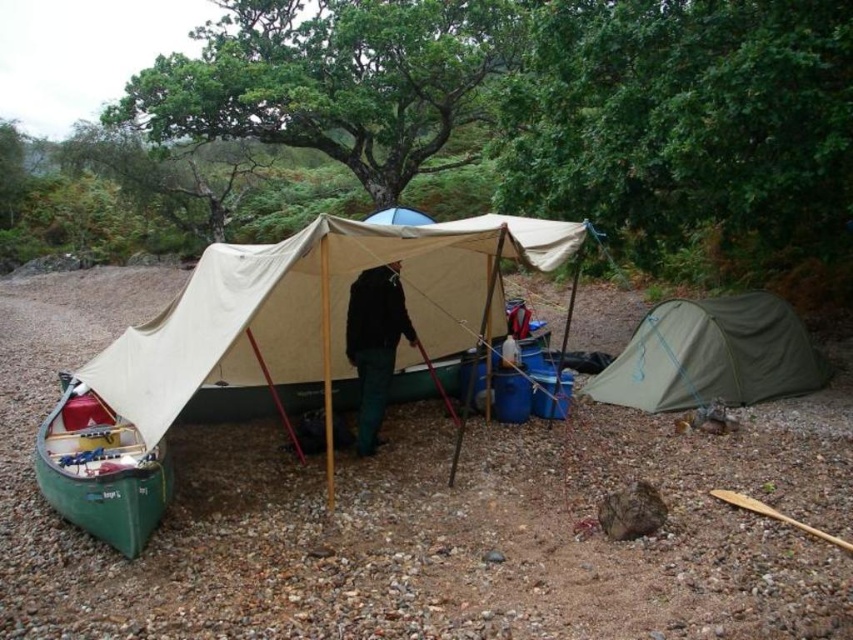
From the picture: You are setting up a campsite and need to access the items stored in the green matte canoe at lower left. However, there is a green fabric tent at lower right in the way. Based on the scene, can you easily reach the canoe without moving the tent?

The green fabric tent at lower right is above the green matte canoe at lower left. Since the tent is positioned above the canoe, you can still access the canoe without moving the tent as long as there is space underneath the tent.

You are planning to set up a tent in the camping area shown. You have a new tent that is the same size as the green matte canoe at lower left. Can your new tent fit in the space currently occupied by the green fabric tent at lower right?

The green fabric tent at lower right is bigger than the green matte canoe at lower left. Since your new tent is the same size as the canoe, it would fit in the space currently occupied by the green fabric tent at lower right because the existing space is larger.

You are a hiker who just arrived at the campsite and want to store your backpack in the closest available shelter. You have a backpack that is 1.2 meters wide. The green fabric tent at lower right and the black fabric jacket at center are both potential shelters. Which shelter can accommodate your backpack?

The green fabric tent at lower right is 3.44 meters away from the black fabric jacket at center. Since the backpack is 1.2 meters wide, the closest shelter would depend on proximity. However, the description only provides the distance between the two objects, not their individual distances from you. Therefore, it is unclear which shelter is closer to determine accommodation based on width alone.